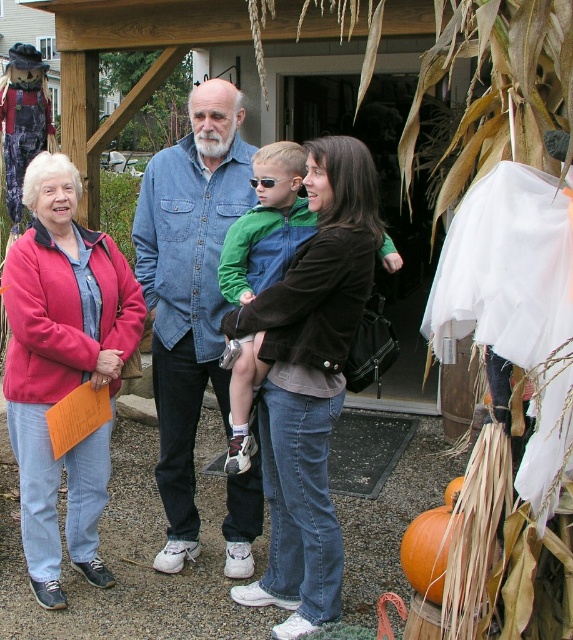
You are a photographer standing at the center of the scene. You want to take a photo of the matte pink jacket at left. Where should you aim your camera to capture it?

The matte pink jacket at left is located at point 0.575 on the horizontal axis and 0.110 on the vertical axis, so you should aim your camera towards those coordinates to capture it.

You are a photographer standing 10 inches away from the two jackets. You want to take a photo of both the matte brown jacket at center and the green denim jacket at center. Can you fit both jackets into the frame without moving your position?

The matte brown jacket at center is 9.87 inches away from the green denim jacket at center. Since you are standing 10 inches away from the two jackets, the distance between them is less than your distance, so both jackets can fit into the frame without moving.

You are organizing a photo shoot and need to arrange two models wearing the matte pink jacket at left and denim shirt at center. According to the scene, how should you position them relative to each other?

The matte pink jacket at left should be positioned on the left side of the denim shirt at center, as per the scene description.